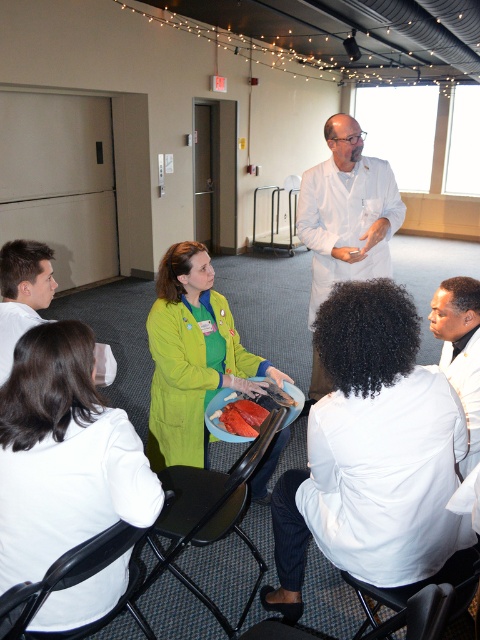
Question: Which of the following is the closest to the observer?

Choices:
 (A) green fabric coat at center
 (B) white lab coat at lower left

Answer: (A)

Question: From the image, what is the correct spatial relationship of white lab coat at lower left in relation to smooth orange plate at center?

Choices:
 (A) above
 (B) below

Answer: (A)

Question: Which object is the farthest from the green matte jacket at center?

Choices:
 (A) smooth white shirt at lower left
 (B) white lab coat at center
 (C) green fabric coat at center

Answer: (C)

Question: Is green fabric coat at center further to the viewer compared to white lab coat at center?

Choices:
 (A) yes
 (B) no

Answer: (B)

Question: Which object is closer to the camera taking this photo?

Choices:
 (A) smooth orange plate at center
 (B) green matte jacket at center
 (C) smooth white shirt at lower left

Answer: (C)

Question: Is green fabric coat at center to the right of green matte jacket at center from the viewer's perspective?

Choices:
 (A) yes
 (B) no

Answer: (A)